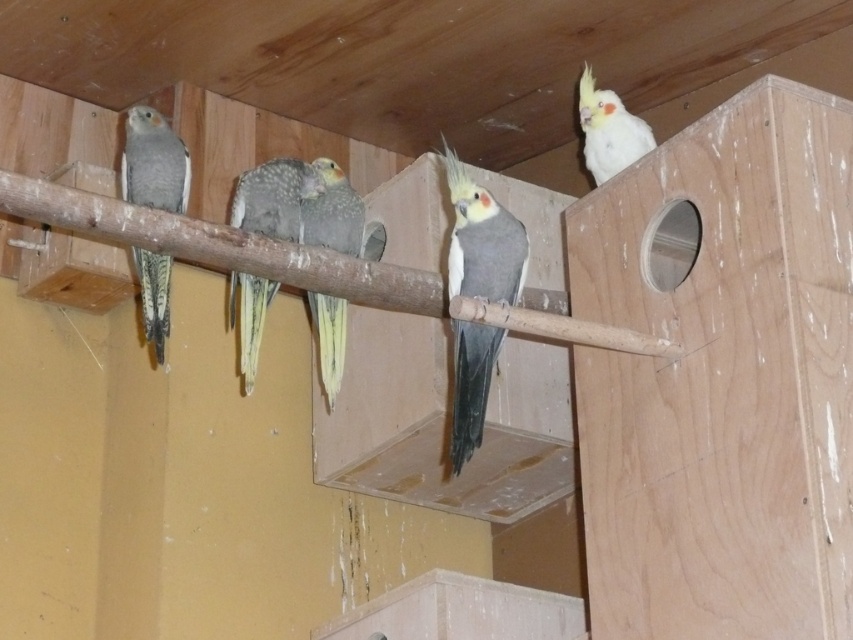
You are standing at the point labeled point (451, 467) and want to walk to the door that leads to the backyard. The path between the two points is 2.26 meters wide. If you are 1.8 meters tall, will you be able to walk through the path without bending down?

The path between the two points is 2.26 meters wide, which is wider than your height of 1.8 meters. Therefore, you can walk through the path without bending down.